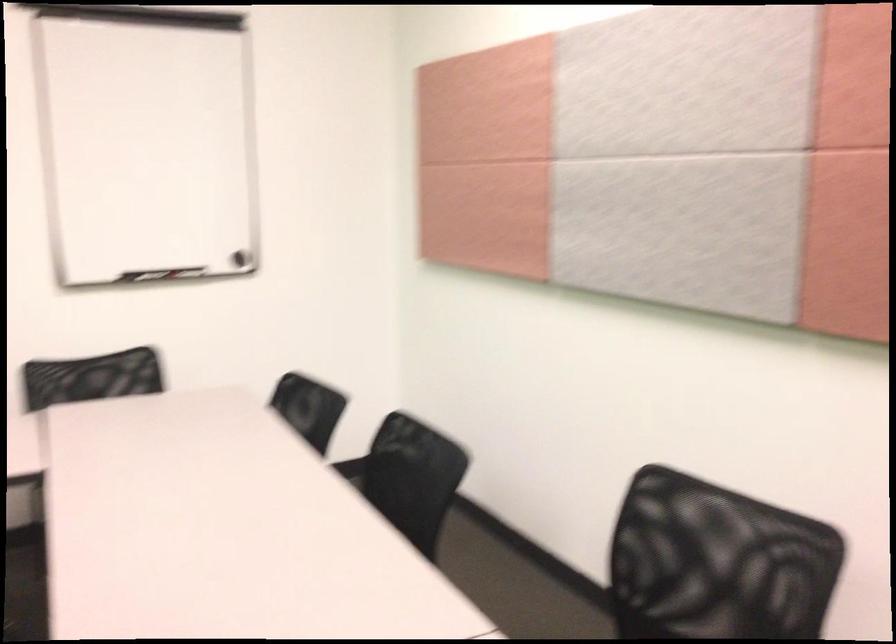
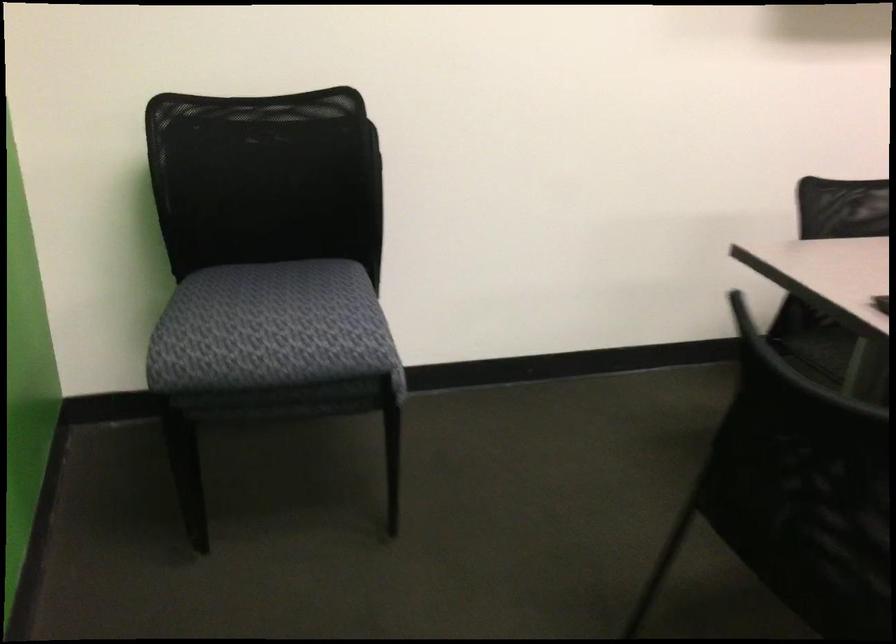
Question: The images are taken continuously from a first-person perspective. In which direction are you moving?

Choices:
 (A) Left
 (B) Right
 (C) Forward
 (D) Backward

Answer: (A)